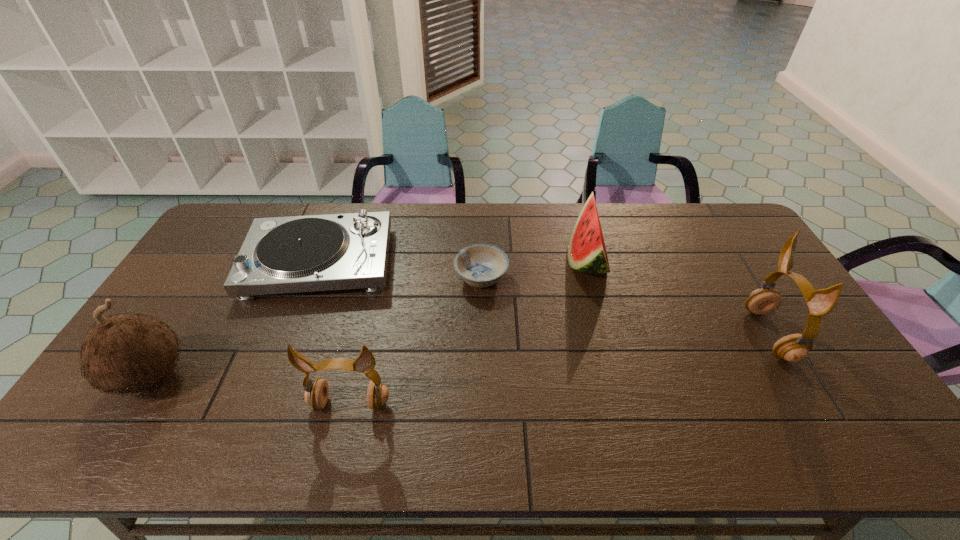
Where is `vacant area that lies between the farther earphone and the coconut`? The image size is (960, 540). vacant area that lies between the farther earphone and the coconut is located at coordinates (460, 355).

Where is `vacant space that's between the farther earphone and the coconut`? vacant space that's between the farther earphone and the coconut is located at coordinates (460, 355).

In order to click on free space between the third shortest object and the coconut in this screenshot , I will do `click(369, 318)`.

This screenshot has height=540, width=960. Identify the location of free spot between the farther earphone and the left earphone. (560, 369).

Find the location of a particular element. free space between the third tallest object and the taller earphone is located at coordinates (560, 369).

You are a GUI agent. You are given a task and a screenshot of the screen. Output one action in this format:
    pyautogui.click(x=<x>, y=<y>)
    Task: Click on the free point between the farther earphone and the fourth tallest object
    
    Given the screenshot: What is the action you would take?
    pyautogui.click(x=678, y=297)

You are a GUI agent. You are given a task and a screenshot of the screen. Output one action in this format:
    pyautogui.click(x=<x>, y=<y>)
    Task: Click on the vacant area between the farther earphone and the nearer earphone
    The image size is (960, 540).
    Given the screenshot: What is the action you would take?
    pyautogui.click(x=560, y=369)

Where is `free area in between the farther earphone and the third object from right to left`? This screenshot has width=960, height=540. free area in between the farther earphone and the third object from right to left is located at coordinates (625, 306).

Where is `free space between the third shortest object and the record player`? The image size is (960, 540). free space between the third shortest object and the record player is located at coordinates (453, 261).

In order to click on free spot between the coconut and the record player in this screenshot , I will do pos(235,319).